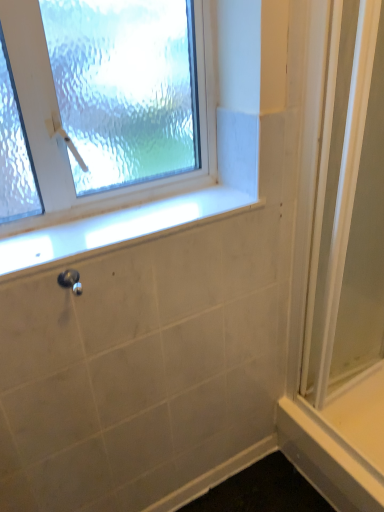
Question: From the image's perspective, is satin nickel shower at lower left on top of clear glass window at upper left?

Choices:
 (A) yes
 (B) no

Answer: (B)

Question: From a real-world perspective, is satin nickel shower at lower left positioned over clear glass window at upper left based on gravity?

Choices:
 (A) yes
 (B) no

Answer: (B)

Question: Does satin nickel shower at lower left come behind clear glass window at upper left?

Choices:
 (A) no
 (B) yes

Answer: (B)

Question: Is satin nickel shower at lower left positioned with its back to clear glass window at upper left?

Choices:
 (A) yes
 (B) no

Answer: (B)

Question: From the image's perspective, does satin nickel shower at lower left appear lower than clear glass window at upper left?

Choices:
 (A) no
 (B) yes

Answer: (B)

Question: Does satin nickel shower at lower left have a lesser width compared to clear glass window at upper left?

Choices:
 (A) no
 (B) yes

Answer: (B)

Question: Is white smooth ledge at lower right to the left of white marble window sill at center from the viewer's perspective?

Choices:
 (A) yes
 (B) no

Answer: (B)

Question: From the image's perspective, is white smooth ledge at lower right located beneath white marble window sill at center?

Choices:
 (A) yes
 (B) no

Answer: (A)

Question: Is white smooth ledge at lower right oriented away from white marble window sill at center?

Choices:
 (A) yes
 (B) no

Answer: (B)

Question: From the image's perspective, is white smooth ledge at lower right on white marble window sill at center?

Choices:
 (A) no
 (B) yes

Answer: (A)

Question: Can you confirm if white smooth ledge at lower right is wider than white marble window sill at center?

Choices:
 (A) no
 (B) yes

Answer: (A)

Question: Is white smooth ledge at lower right smaller than white marble window sill at center?

Choices:
 (A) no
 (B) yes

Answer: (A)

Question: From a real-world perspective, is clear glass screen door at right beneath white marble window sill at center?

Choices:
 (A) no
 (B) yes

Answer: (B)